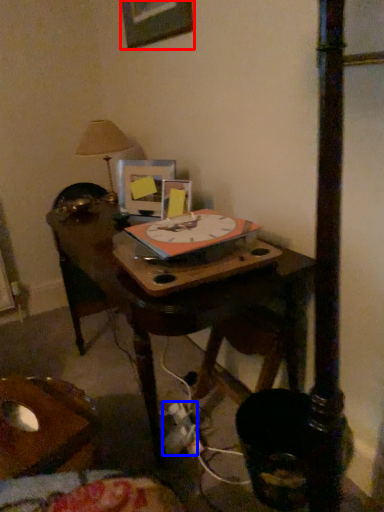
Question: Which point is closer to the camera, picture frame (highlighted by a red box) or plug (highlighted by a blue box)?

Choices:
 (A) picture frame
 (B) plug

Answer: (B)